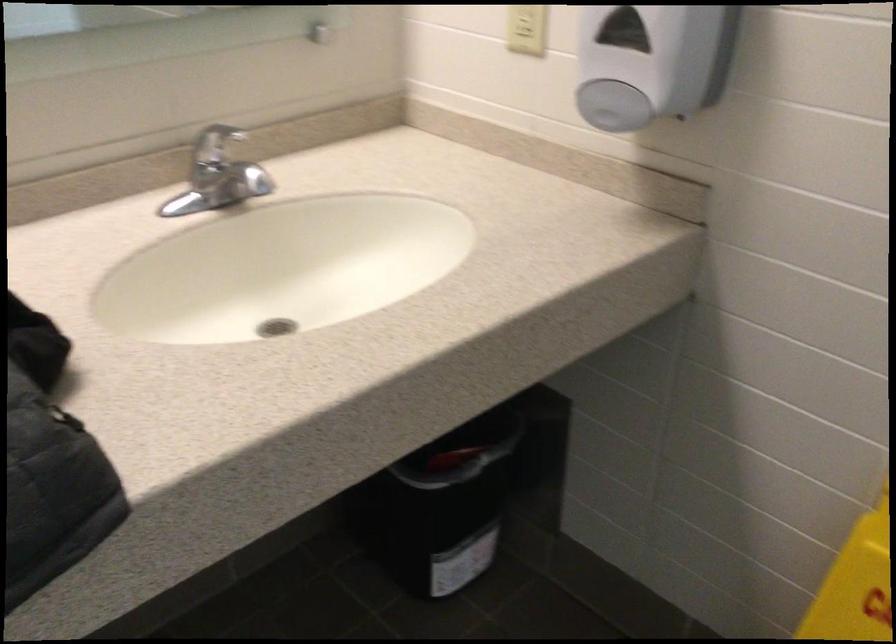
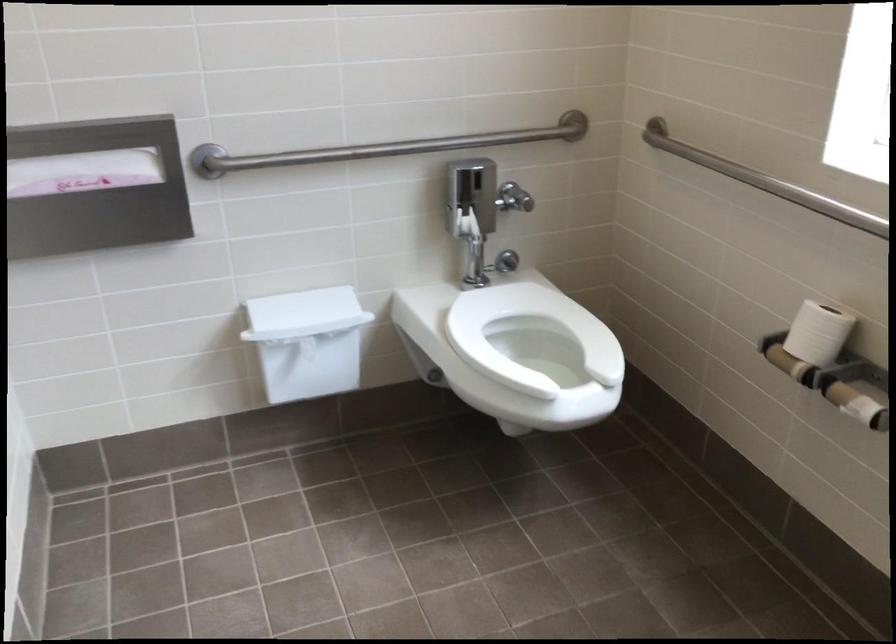
Which direction would the cameraman need to move to produce the second image?

The movement direction of the cameraman is right, forward.